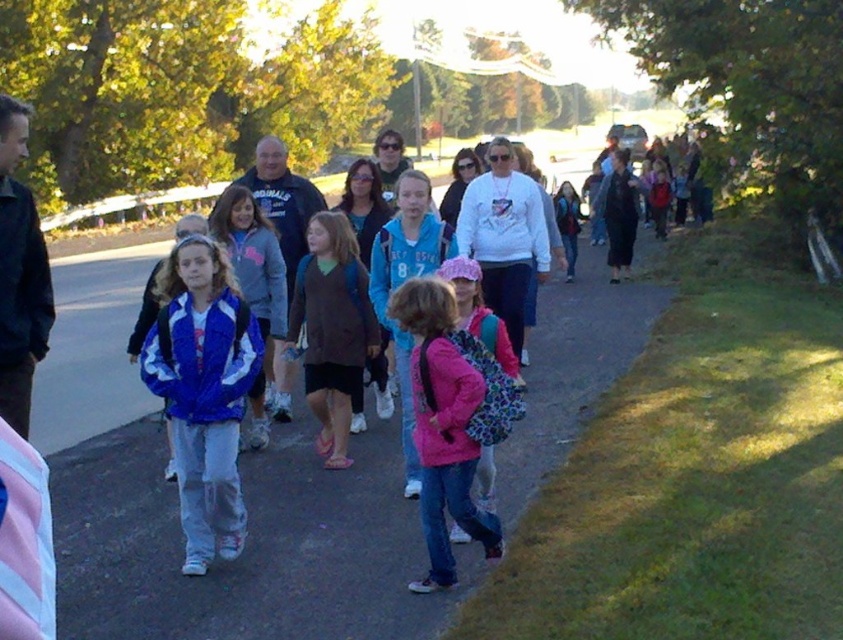
Question: Does blue fabric backpack at center have a lesser width compared to pink fabric backpack at center?

Choices:
 (A) yes
 (B) no

Answer: (B)

Question: Which object is positioned farthest from the dark blue hoodie at center?

Choices:
 (A) white matte sweatshirt at center
 (B) blue synthetic jacket at center
 (C) pink fabric backpack at center
 (D) blue fabric backpack at center

Answer: (C)

Question: Which point is closer to the camera?

Choices:
 (A) pink fabric backpack at center
 (B) brown sweater at center
 (C) dark blue hoodie at center
 (D) blue synthetic jacket at center

Answer: (A)

Question: Can you confirm if blue fabric backpack at center is positioned to the left of white matte sweatshirt at center?

Choices:
 (A) yes
 (B) no

Answer: (A)

Question: Among these points, which one is nearest to the camera?

Choices:
 (A) (396, 570)
 (B) (323, 433)
 (C) (250, 173)

Answer: (A)

Question: Is pink fabric backpack at center wider than brown sweater at center?

Choices:
 (A) no
 (B) yes

Answer: (A)